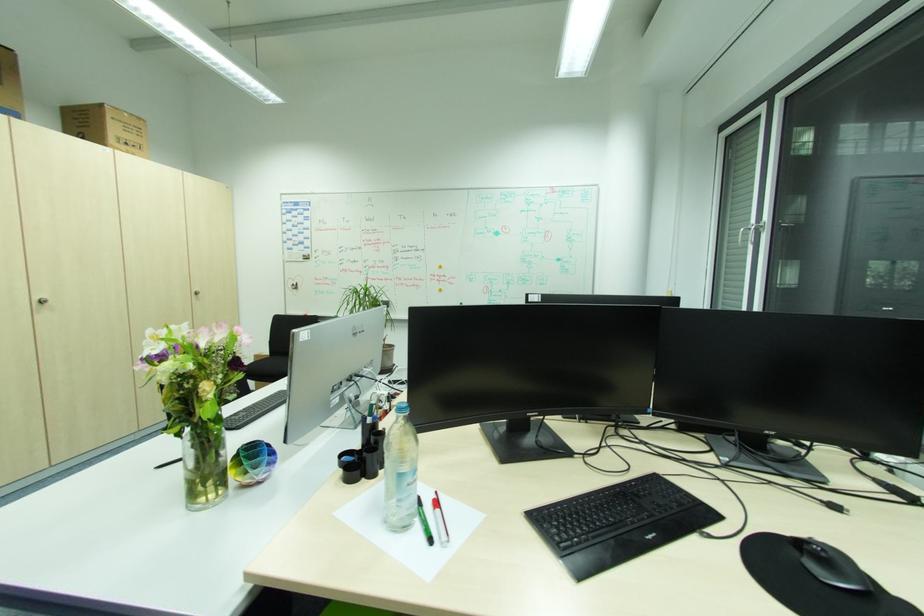
What do you see at coordinates (197, 294) in the screenshot? I see `a silver door handle` at bounding box center [197, 294].